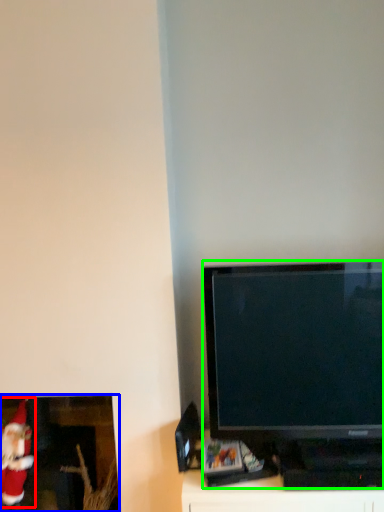
Question: Which is nearer to the santa claus (highlighted by a red box)? picture frame (highlighted by a blue box) or television (highlighted by a green box).

Choices:
 (A) picture frame
 (B) television

Answer: (A)